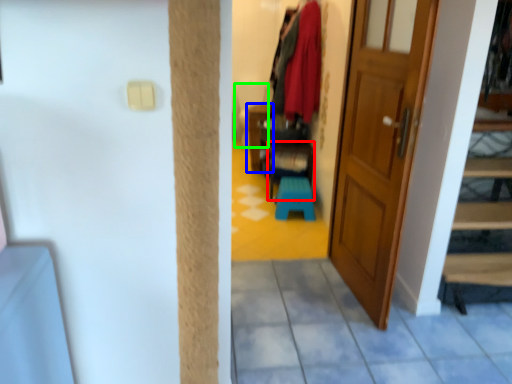
Question: Estimate the real-world distances between objects in this image. Which object is closer to furniture (highlighted by a red box), furniture (highlighted by a blue box) or armchair (highlighted by a green box)?

Choices:
 (A) furniture
 (B) armchair

Answer: (A)